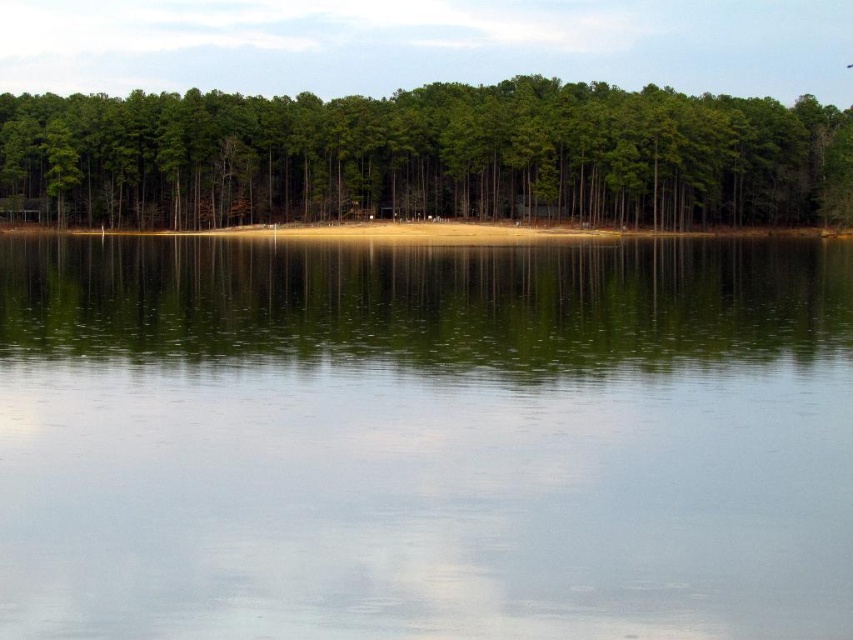
Does point (552, 252) come closer to viewer compared to point (160, 177)?

Yes, it is.

Does green reflective water at center have a lesser width compared to green matte trees at upper center?

Correct, green reflective water at center's width is less than green matte trees at upper center's.

Between point (113, 410) and point (271, 186), which one is positioned in front?

Point (113, 410) is in front.

Find the location of a particular element. The height and width of the screenshot is (640, 853). green reflective water at center is located at coordinates (424, 440).